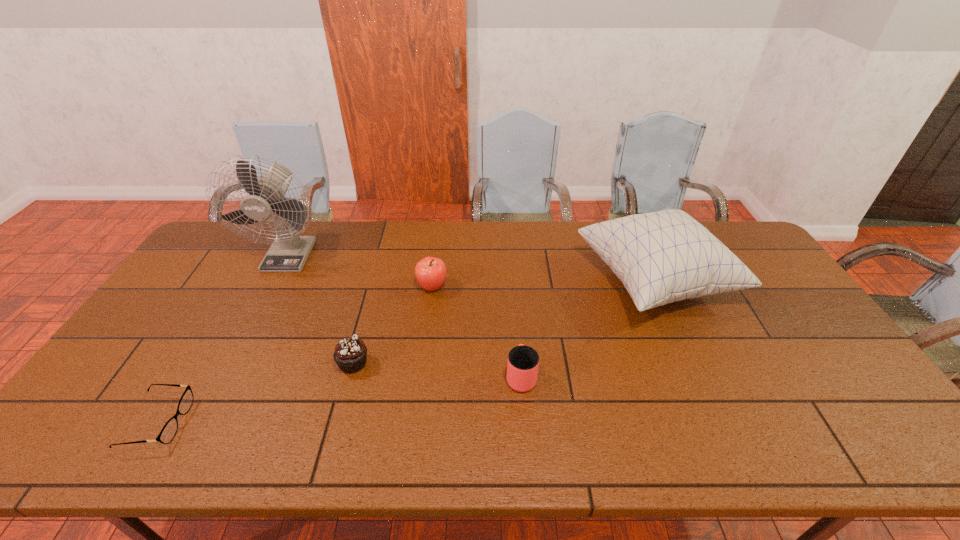
Locate an element on the screen. vacant space in between the fan and the spectacles is located at coordinates (224, 338).

Identify the location of vacant space that is in between the third tallest object and the rightmost object. This screenshot has width=960, height=540. (543, 285).

I want to click on free point between the second object from right to left and the second tallest object, so click(x=588, y=329).

You are a GUI agent. You are given a task and a screenshot of the screen. Output one action in this format:
    pyautogui.click(x=<x>, y=<y>)
    Task: Click on the vacant space that is in between the fourth object from right to left and the apple
    
    Given the screenshot: What is the action you would take?
    pyautogui.click(x=393, y=325)

At what (x,y) coordinates should I click in order to perform the action: click on vacant space that's between the cupcake and the spectacles. Please return your answer as a coordinate pair (x, y). This screenshot has height=540, width=960. Looking at the image, I should click on (255, 393).

Where is `free spot between the tallest object and the fifth shortest object`? free spot between the tallest object and the fifth shortest object is located at coordinates coord(472,268).

The width and height of the screenshot is (960, 540). Find the location of `blank region between the apple and the shortest object`. blank region between the apple and the shortest object is located at coordinates (295, 354).

Locate an element on the screen. vacant space that's between the rightmost object and the fourth shortest object is located at coordinates (543, 285).

Identify which object is the second closest to the cup. Please provide its 2D coordinates. Your answer should be formatted as a tuple, i.e. [(x, y)], where the tuple contains the x and y coordinates of a point satisfying the conditions above.

[(430, 272)]

Where is `object that stands as the closest to the third object from right to left`? This screenshot has width=960, height=540. object that stands as the closest to the third object from right to left is located at coordinates (350, 354).